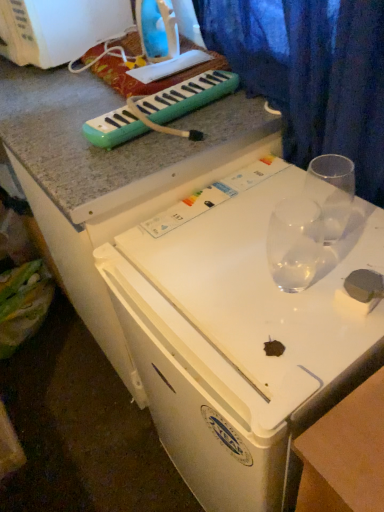
Where is `free space to the left of clear glass martini glass at center, the 2th martini glass positioned from the right`? The image size is (384, 512). free space to the left of clear glass martini glass at center, the 2th martini glass positioned from the right is located at coordinates (209, 279).